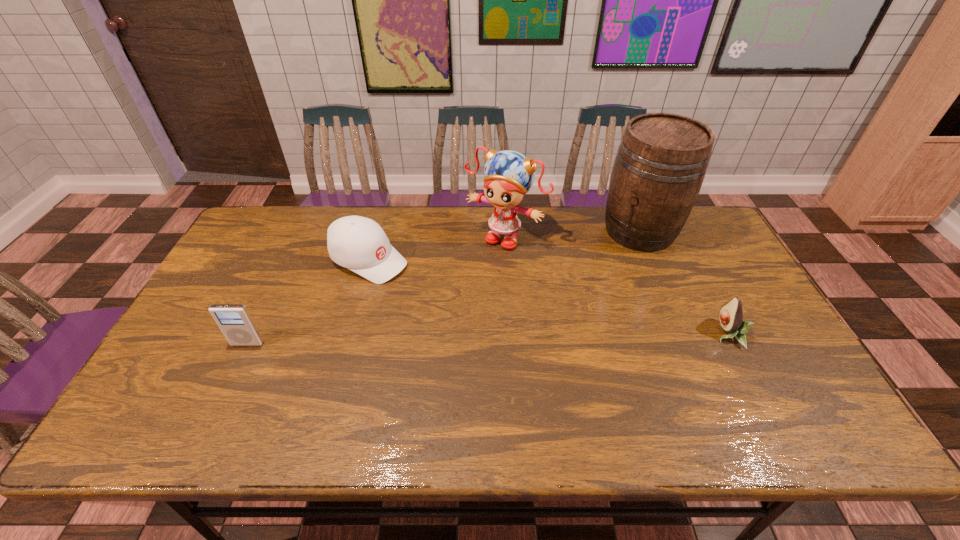
Where is `vacant space that satisfies the following two spatial constraints: 1. on the front side of the avocado; 2. on the seed side of the second tallest object`? vacant space that satisfies the following two spatial constraints: 1. on the front side of the avocado; 2. on the seed side of the second tallest object is located at coordinates (512, 334).

Locate an element on the screen. vacant point that satisfies the following two spatial constraints: 1. on the front side of the fourth object from right to left; 2. on the seed side of the avocado is located at coordinates (348, 334).